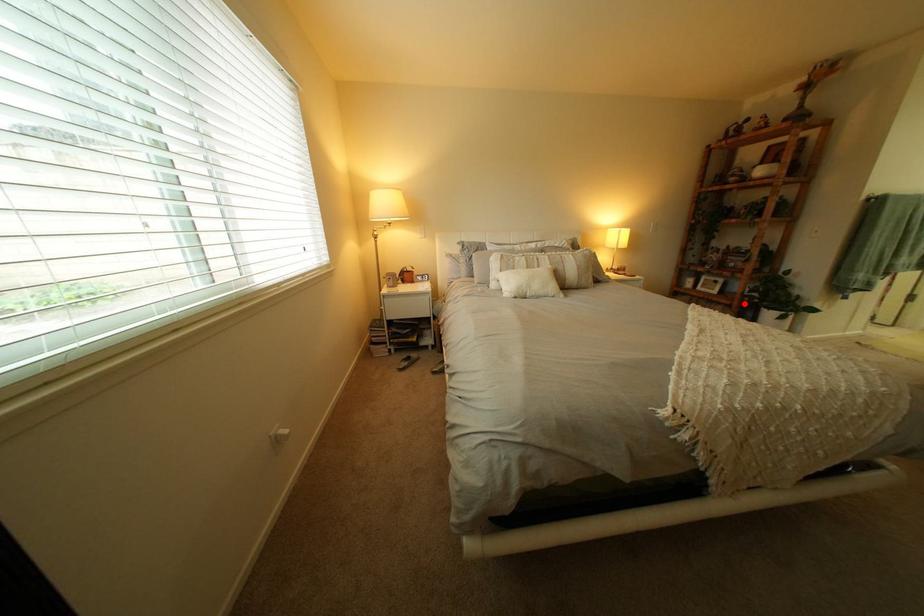
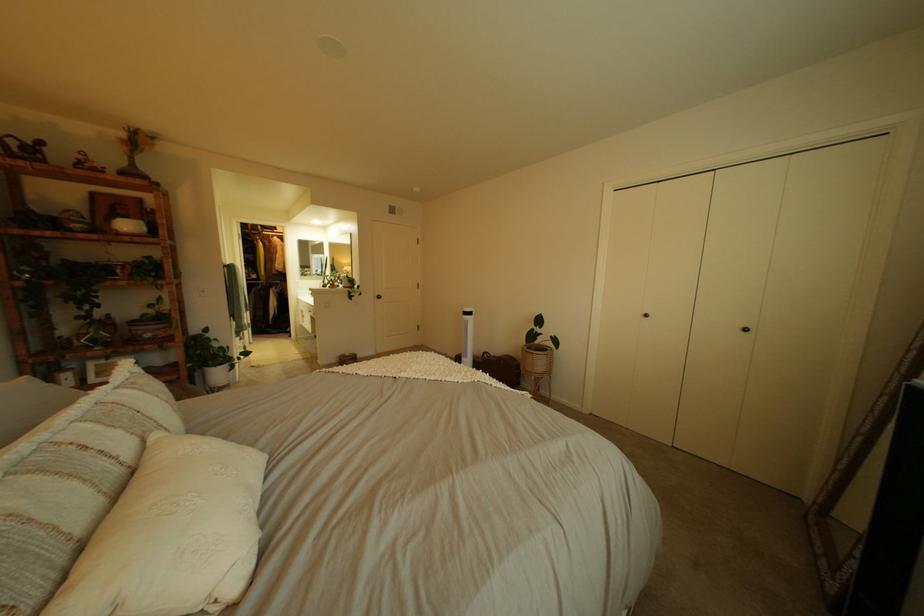
Where in the second image is the point corresponding to the highlighted location from the first image?

(189, 379)